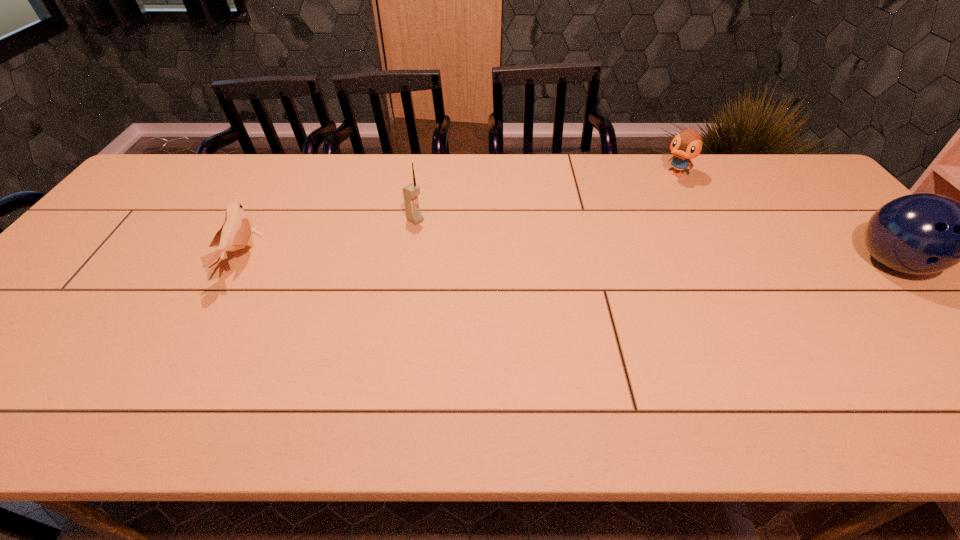
Locate an element on the screen. The image size is (960, 540). free space at the far right corner is located at coordinates (758, 170).

Locate an element on the screen. vacant space that is in between the rightmost object and the second object from right to left is located at coordinates (783, 219).

Identify the location of free space between the cellular telephone and the bowling ball. The image size is (960, 540). (654, 242).

You are a GUI agent. You are given a task and a screenshot of the screen. Output one action in this format:
    pyautogui.click(x=<x>, y=<y>)
    Task: Click on the unoccupied position between the farthest object and the second object from left to right
    The image size is (960, 540).
    Given the screenshot: What is the action you would take?
    pyautogui.click(x=545, y=197)

Find the location of `free spot between the bowling ball and the duck`. free spot between the bowling ball and the duck is located at coordinates (783, 219).

You are a GUI agent. You are given a task and a screenshot of the screen. Output one action in this format:
    pyautogui.click(x=<x>, y=<y>)
    Task: Click on the free spot between the second object from left to right and the second shortest object
    This screenshot has height=540, width=960.
    Given the screenshot: What is the action you would take?
    pyautogui.click(x=545, y=197)

The height and width of the screenshot is (540, 960). Identify the location of vacant area that lies between the third object from left to right and the third nearest object. (545, 197).

You are a GUI agent. You are given a task and a screenshot of the screen. Output one action in this format:
    pyautogui.click(x=<x>, y=<y>)
    Task: Click on the free spot between the bowling ball and the third nearest object
    
    Given the screenshot: What is the action you would take?
    pyautogui.click(x=654, y=242)

What are the coordinates of `empty location between the shortest object and the bowling ball` in the screenshot? It's located at (566, 261).

You are a GUI agent. You are given a task and a screenshot of the screen. Output one action in this format:
    pyautogui.click(x=<x>, y=<y>)
    Task: Click on the empty space that is in between the third object from right to left and the bird
    
    Given the screenshot: What is the action you would take?
    pyautogui.click(x=328, y=239)